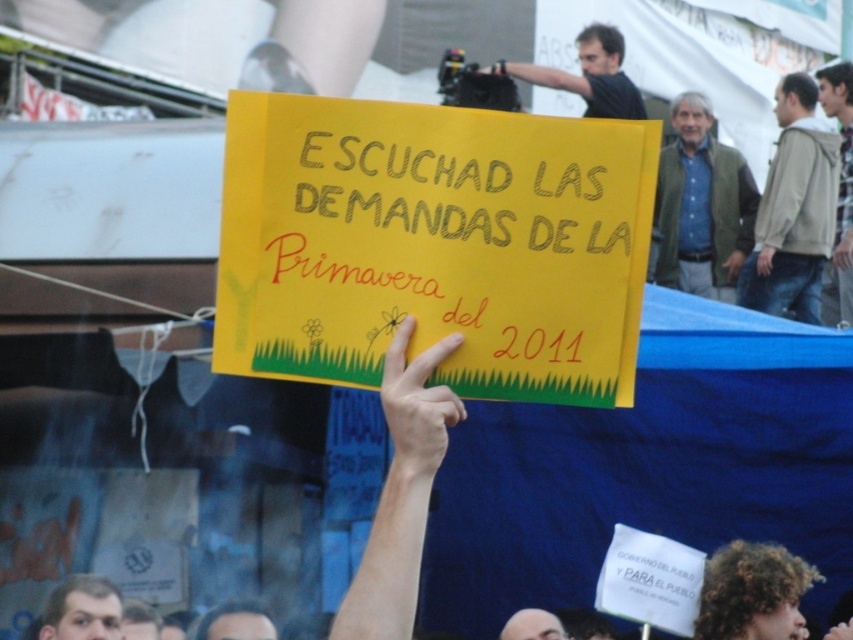
You are a photographer trying to capture the skinny yellow sign at center in your shot. The sign is located at coordinates point 0.636, 0.489. If your camera frame is centered at point 0.5, 0.5, will the sign be in the center of your photo?

The skinny yellow sign at center is located at point (x=416, y=406), which is offset from the camera frame center at (x=426, y=320). Therefore, the sign will not be in the exact center of the photo.

You are a photographer trying to capture a photo of the protest scene. You want to ensure both the light brown jacket at right and the green textured jacket at upper right are visible in your shot. Based on their positions, which jacket should you focus on first to frame the shot properly?

The light brown jacket at right is below the green textured jacket at upper right, so you should focus on the green textured jacket at upper right first to ensure both are in frame.

You are a photographer taking a picture of the protest scene. You notice two points in the image at coordinates point [779,186] and point [543,625]. Which point is closer to your camera lens?

Point [543,625] is closer to the camera lens because it is less further than point [779,186].